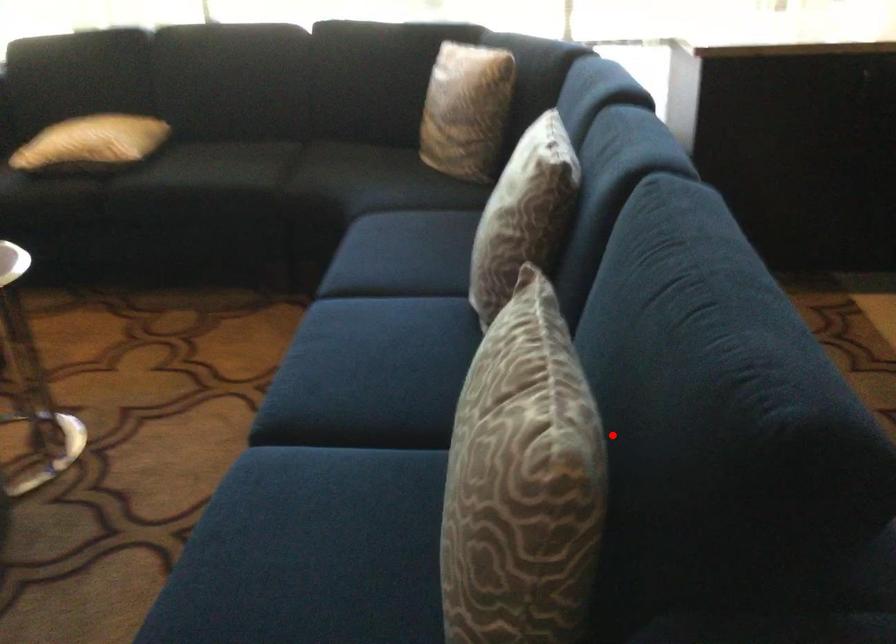
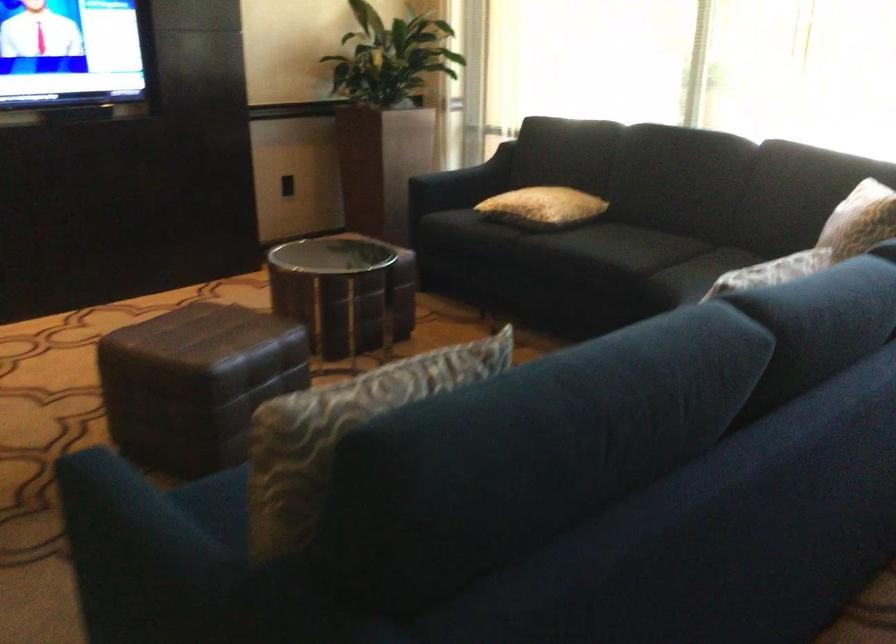
Find the pixel in the second image that matches the highlighted location in the first image.

(340, 431)